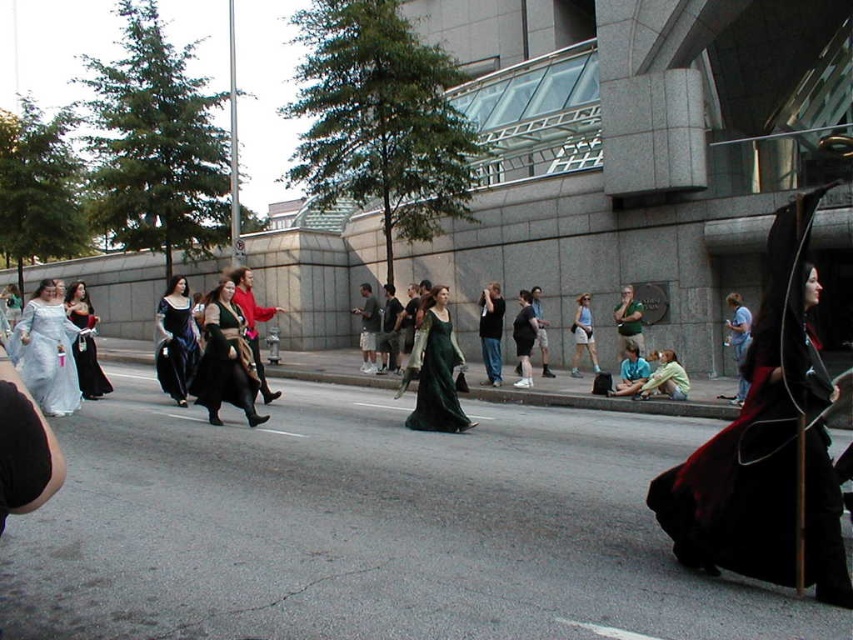
Question: Does velvet black robe at right appear over green velvet gown at center?

Choices:
 (A) no
 (B) yes

Answer: (B)

Question: Based on their relative distances, which object is nearer to the velvet green dress at center?

Choices:
 (A) matte black dress at center
 (B) matte black dress at left
 (C) velvet black robe at right

Answer: (A)

Question: From the image, what is the correct spatial relationship of velvet black robe at right in relation to green velvet gown at center?

Choices:
 (A) above
 (B) below

Answer: (A)

Question: Which of these objects is positioned farthest from the green velvet gown at center?

Choices:
 (A) velvet green dress at center
 (B) velvet black robe at right

Answer: (B)

Question: Is velvet green dress at center in front of green velvet gown at center?

Choices:
 (A) yes
 (B) no

Answer: (A)

Question: Which point is closer to the camera?

Choices:
 (A) velvet black robe at right
 (B) matte white gown at center

Answer: (A)